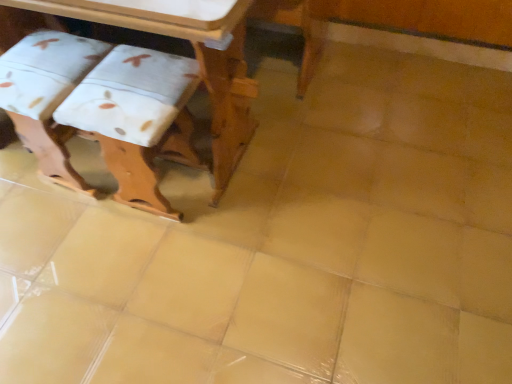
Locate an element on the screen. free spot in front of white fabric step stool at lower left, arranged as the 2th step stool when viewed from the right is located at coordinates (66, 233).